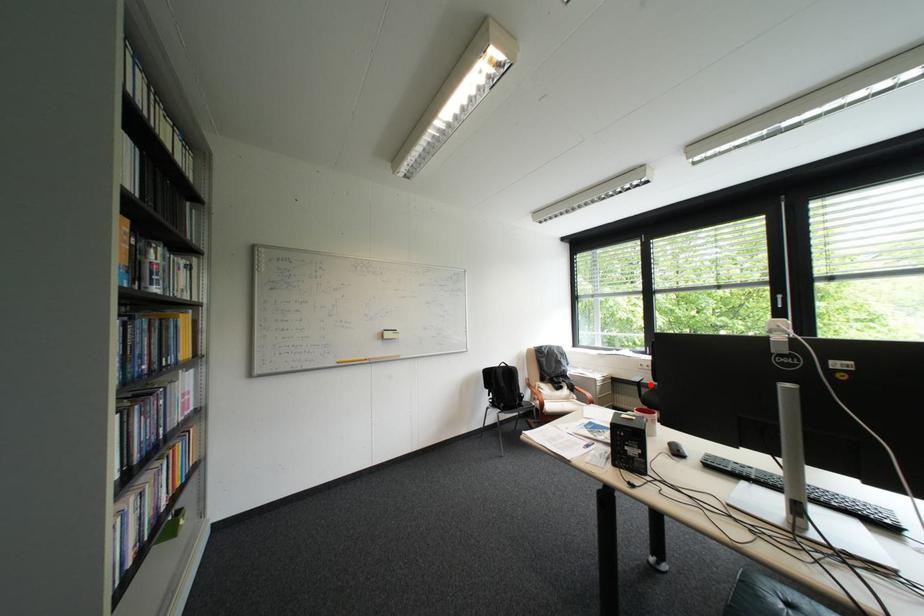
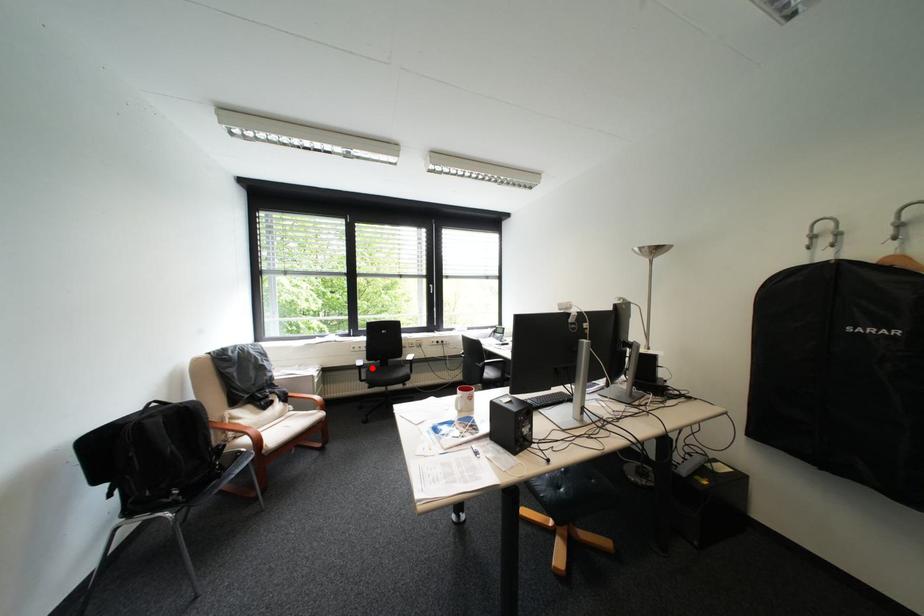
I am providing you with two images of the same scene from different viewpoints. A red point is marked on the first image and another point is marked on the second image. Does the point marked in image1 correspond to the same location as the one in image2?

Yes